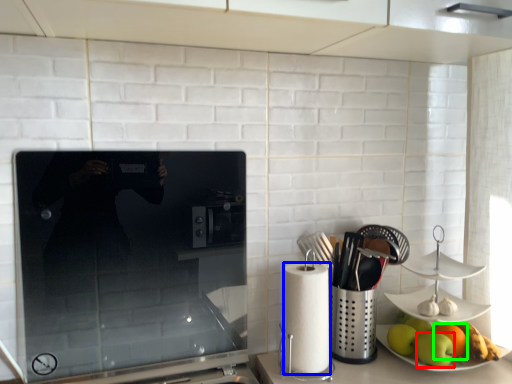
Question: Estimate the real-world distances between objects in this image. Which object is closer to apple (highlighted by a red box), paper towel (highlighted by a blue box) or orange (highlighted by a green box)?

Choices:
 (A) paper towel
 (B) orange

Answer: (B)